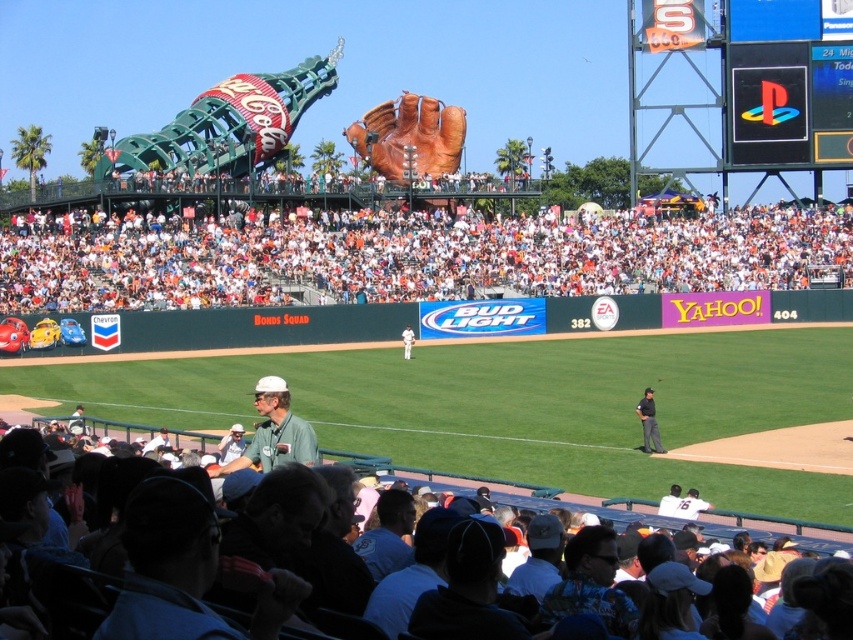
You are a photographer at the baseball game and want to capture a photo of both the brown leather baseball glove at center and the green matte shirt at center. Based on their positions, which one is higher in the image?

The brown leather baseball glove at center is above the green matte shirt at center, so it is higher in the image.

You are a photographer standing at the position of the camera. You want to capture a closeup shot of the brown leather baseball glove at center. Given that the camera has a maximum zoom range of 200 feet, can you get a clear closeup without moving closer?

The brown leather baseball glove at center and camera are 418.14 feet apart from each other. Since the maximum zoom range of the camera is 200 feet, the distance is too far to capture a clear closeup without moving closer.